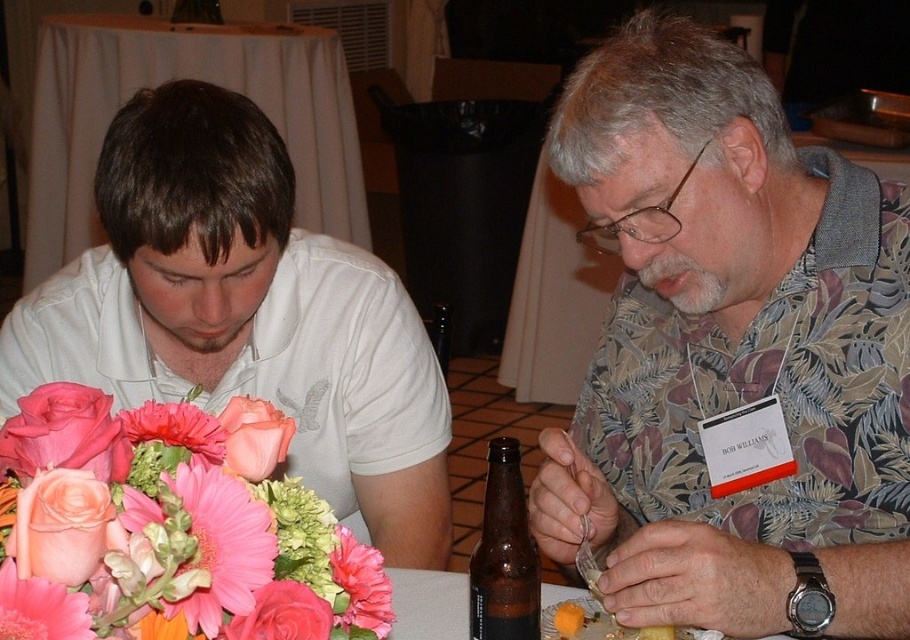
Can you confirm if floral-patterned shirt at center is positioned to the right of matte white shirt at center?

Indeed, floral-patterned shirt at center is positioned on the right side of matte white shirt at center.

Does floral-patterned shirt at center appear over matte white shirt at center?

Yes, floral-patterned shirt at center is above matte white shirt at center.

Is point (693, 452) behind point (217, 196)?

Yes, point (693, 452) is farther from viewer.

Locate an element on the screen. floral-patterned shirt at center is located at coordinates (731, 349).

Can you confirm if pink matte flowers at lower left is taller than orange cheese at lower center?

Yes, pink matte flowers at lower left is taller than orange cheese at lower center.

Does pink matte flowers at lower left have a lesser width compared to orange cheese at lower center?

No.

Which is in front, point (46, 548) or point (553, 625)?

Point (46, 548)

This screenshot has height=640, width=910. In order to click on pink matte flowers at lower left in this screenshot , I will do 170,529.

Is wooden table at center to the left of pink matte gerbera at center from the viewer's perspective?

Incorrect, wooden table at center is not on the left side of pink matte gerbera at center.

Which is more to the left, wooden table at center or pink matte gerbera at center?

pink matte gerbera at center

Is point (559, 340) farther from viewer compared to point (27, 580)?

Yes, point (559, 340) is behind point (27, 580).

This screenshot has width=910, height=640. What are the coordinates of `wooden table at center` in the screenshot? It's located at (553, 298).